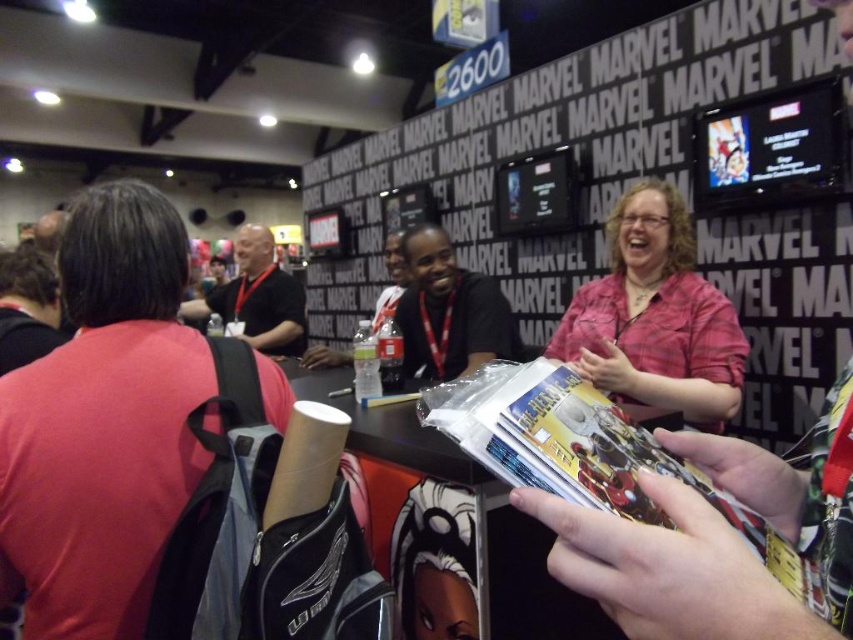
You are attending a Marvel convention and see a person in the foreground. Where exactly is the red fabric shirt at left located in the image?

The red fabric shirt at left is located at point [103,422].

Based on the photo, you are a convention attendee who wants to take a photo of both the pink plaid shirt at center and the black matte shirt at center in the same frame. The camera you are using has a minimum focus distance of 16 inches. Can you capture both shirts in focus without moving either the camera or the shirts?

The pink plaid shirt at center is 16.87 inches away from the black matte shirt at center. Since the distance between them is greater than the camera minimum focus distance of 16 inches, you can capture both shirts in focus without moving the camera or the shirts.

You are at a convention and see two shirts at the center of the image. The pink plaid shirt at center and the black matte shirt at center. Which shirt is more visible to you?

The pink plaid shirt at center is closer to the viewer than the black matte shirt at center, so it is more visible.